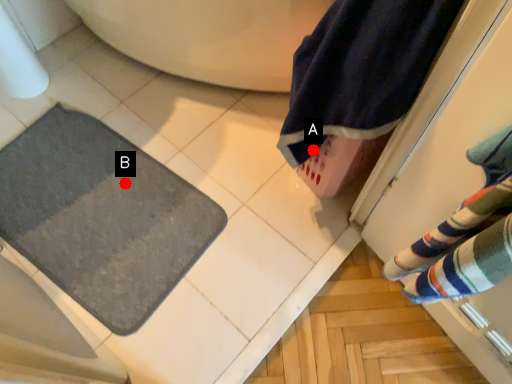
Question: Two points are circled on the image, labeled by A and B beside each circle. Which point is closer to the camera taking this photo?

Choices:
 (A) A is closer
 (B) B is closer

Answer: (A)